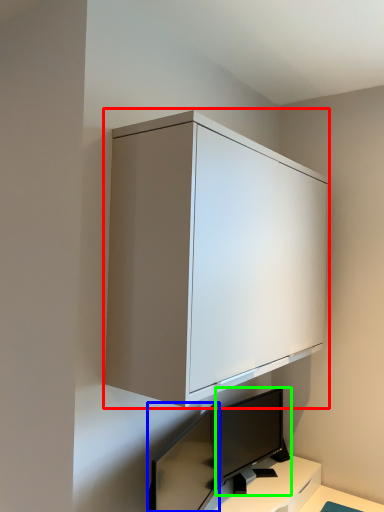
Question: Estimate the real-world distances between objects in this image. Which object is farther from cabinetry (highlighted by a red box), computer monitor (highlighted by a blue box) or computer monitor (highlighted by a green box)?

Choices:
 (A) computer monitor
 (B) computer monitor

Answer: (A)